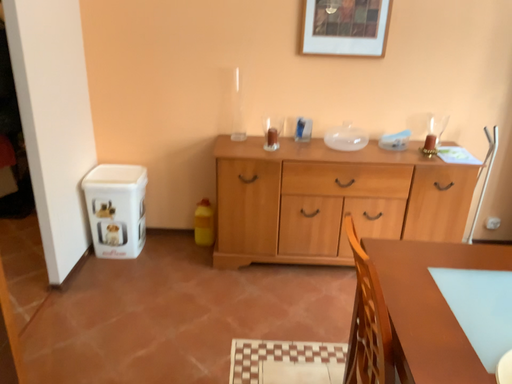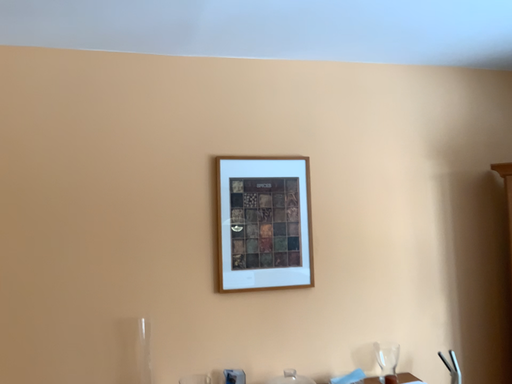
Question: How did the camera likely rotate when shooting the video?

Choices:
 (A) rotated left
 (B) rotated right

Answer: (B)